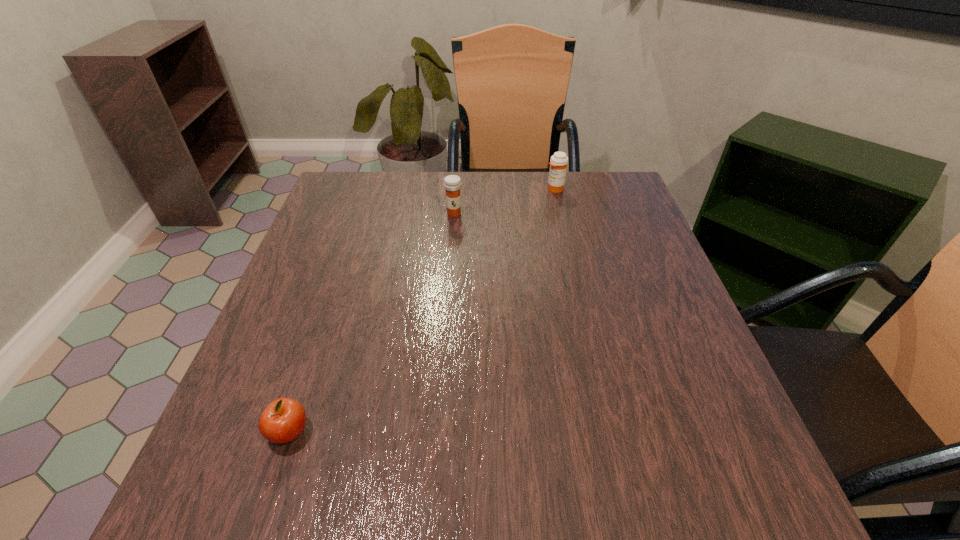
Where is `vacant area that lies between the shortest object and the rightmost object`? This screenshot has height=540, width=960. vacant area that lies between the shortest object and the rightmost object is located at coordinates (422, 310).

Where is `free space between the nearest object and the second farthest object`? This screenshot has height=540, width=960. free space between the nearest object and the second farthest object is located at coordinates (372, 323).

Where is `empty space that is in between the shortest object and the farthest object`? The width and height of the screenshot is (960, 540). empty space that is in between the shortest object and the farthest object is located at coordinates (422, 310).

You are a GUI agent. You are given a task and a screenshot of the screen. Output one action in this format:
    pyautogui.click(x=<x>, y=<y>)
    Task: Click on the vacant area between the nearer medicine and the right medicine
    The image size is (960, 540).
    Given the screenshot: What is the action you would take?
    pyautogui.click(x=504, y=201)

Find the location of a particular element. unoccupied position between the right medicine and the second farthest object is located at coordinates (504, 201).

You are a GUI agent. You are given a task and a screenshot of the screen. Output one action in this format:
    pyautogui.click(x=<x>, y=<y>)
    Task: Click on the empty space that is in between the left medicine and the farther medicine
    This screenshot has height=540, width=960.
    Given the screenshot: What is the action you would take?
    pyautogui.click(x=504, y=201)

Image resolution: width=960 pixels, height=540 pixels. In order to click on object that can be found as the second closest to the second nearest object in this screenshot , I will do `click(283, 420)`.

You are a GUI agent. You are given a task and a screenshot of the screen. Output one action in this format:
    pyautogui.click(x=<x>, y=<y>)
    Task: Click on the second closest object to the nearer medicine
    
    Given the screenshot: What is the action you would take?
    point(283,420)